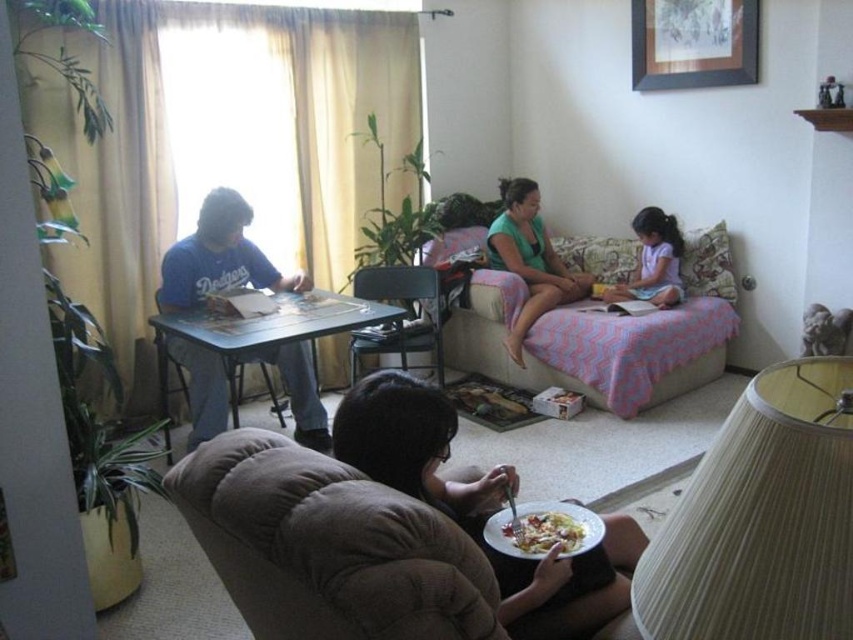
You are a guest in this living room and want to sit down. The pink fabric couch at upper center and the matte black table at left are in view. Which one is higher?

The pink fabric couch at upper center is much taller than the matte black table at left, so the couch is higher.

What is located at the coordinates point [263,326]?

The blue plastic table at left is located at point [263,326].